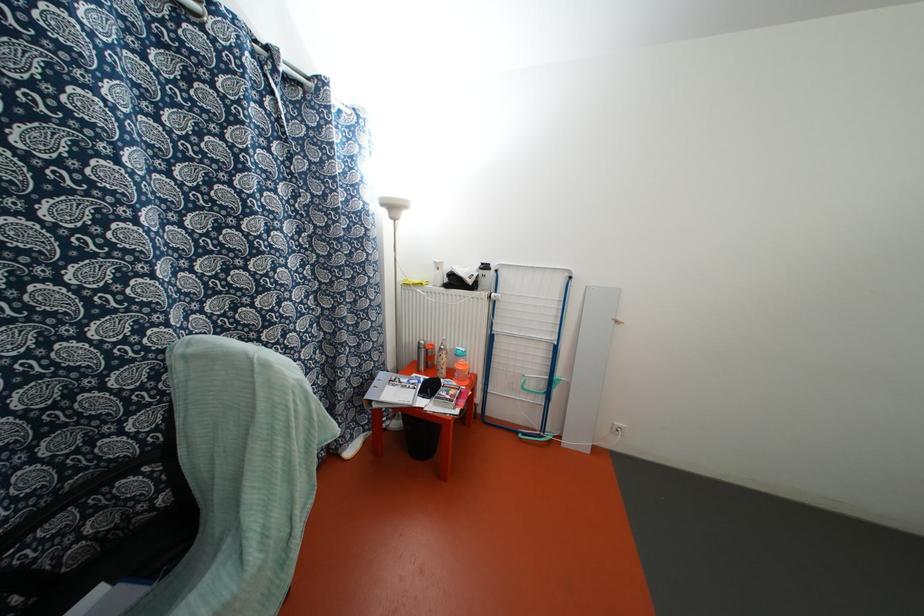
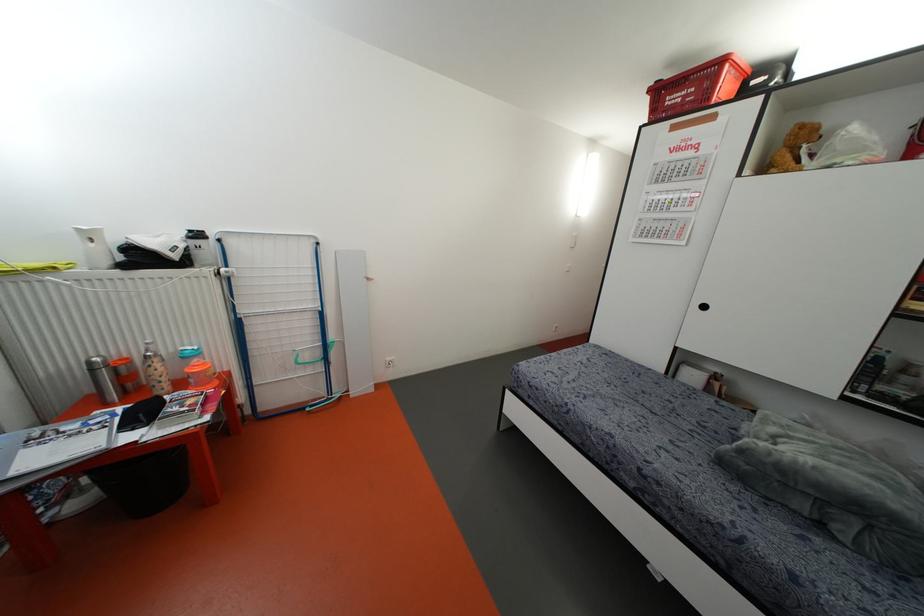
The point at (419, 347) is marked in the first image. Where is the corresponding point in the second image?

(91, 370)